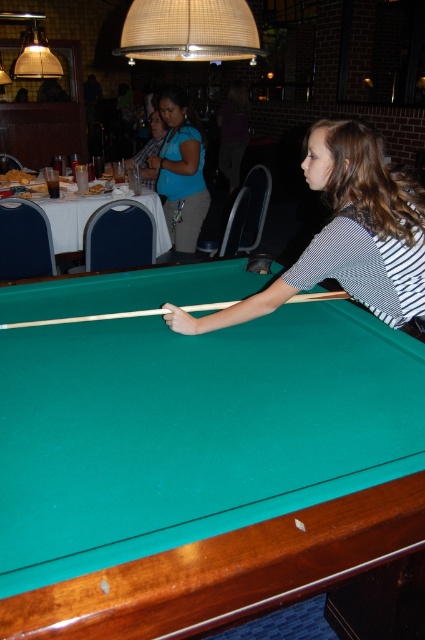
You are a photographer standing at the entrance of the bar. You want to take a photo of the striped shirt at center so that it fills the frame. Given that your camera has a minimum focusing distance of 5 feet, will you need to step closer or farther away to achieve this?

The striped shirt at center is 5.13 feet away from the camera. Since the minimum focusing distance is 5 feet, you need to step slightly closer to ensure the striped shirt at center is within the camera range.